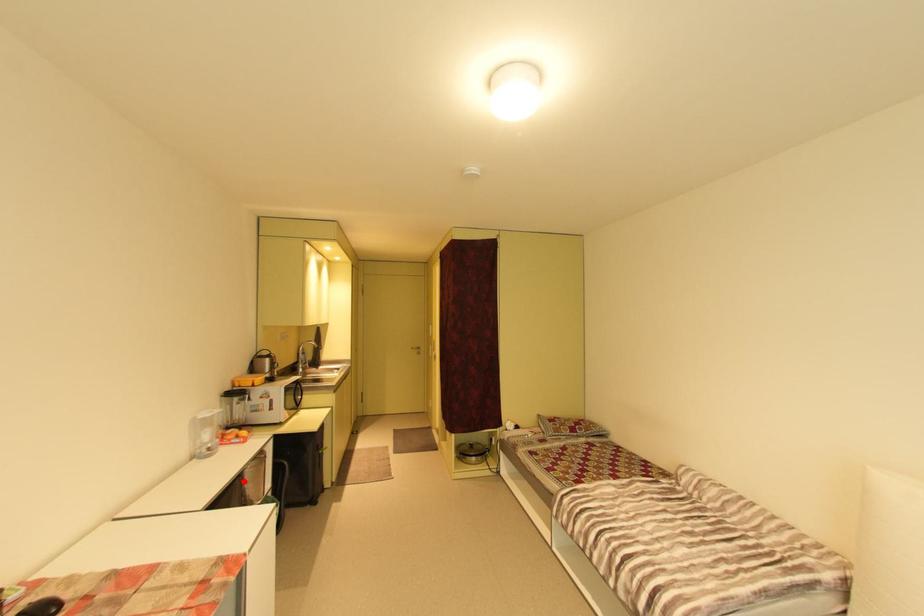
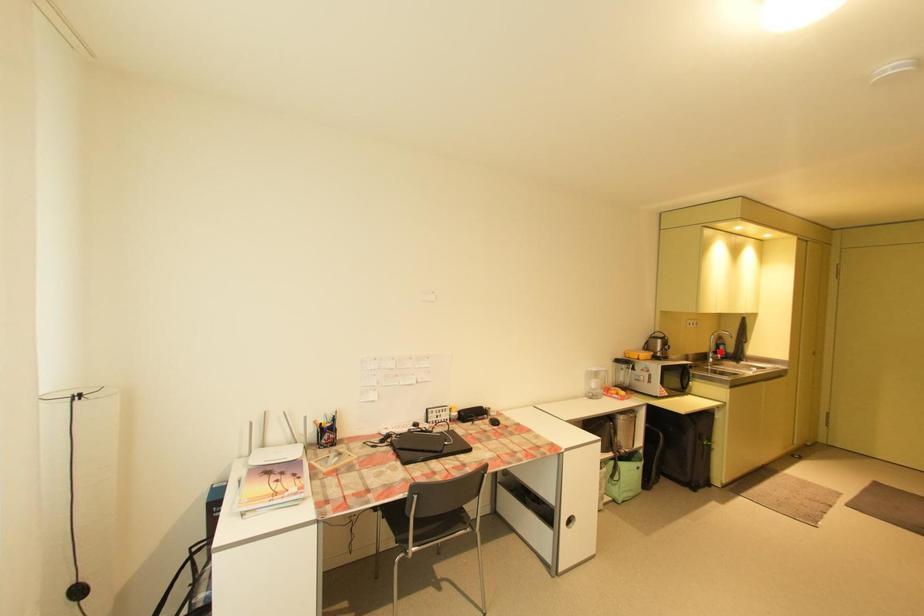
I am providing you with two images of the same scene from different viewpoints. A red point is marked on the first image and another point is marked on the second image. Do the highlighted points in image1 and image2 indicate the same real-world spot?

No